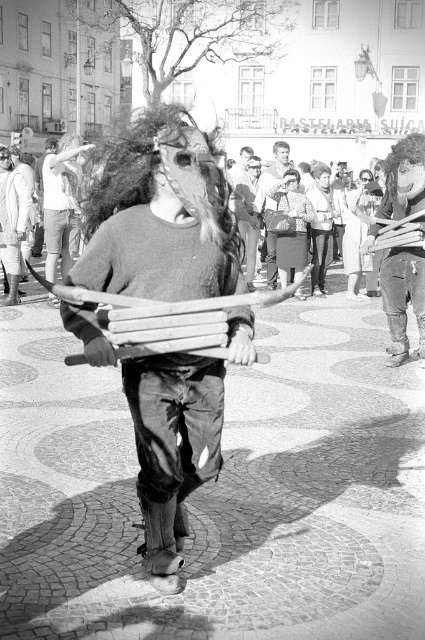
Is smooth leather jacket at center closer to camera compared to smooth brown leather bag at center?

Yes.

How far apart are smooth leather jacket at center and smooth brown leather bag at center?

smooth leather jacket at center and smooth brown leather bag at center are 14.18 inches apart.

Between point (255, 176) and point (286, 157), which one is positioned in front?

Positioned in front is point (255, 176).

The width and height of the screenshot is (425, 640). I want to click on smooth leather jacket at center, so click(248, 212).

Does fluffy dark brown hair at center have a greater height compared to smooth brown leather bag at center?

No, fluffy dark brown hair at center is not taller than smooth brown leather bag at center.

Does fluffy dark brown hair at center have a lesser height compared to smooth brown leather bag at center?

Correct, fluffy dark brown hair at center is not as tall as smooth brown leather bag at center.

Is point (172, 113) farther from camera compared to point (268, 276)?

No.

Identify the location of fluffy dark brown hair at center. This screenshot has width=425, height=640. (164, 173).

Between wooden stick at center and smooth brown leather bag at center, which one appears on the right side from the viewer's perspective?

Positioned to the right is smooth brown leather bag at center.

Does wooden stick at center have a smaller size compared to smooth brown leather bag at center?

Correct, wooden stick at center occupies less space than smooth brown leather bag at center.

In order to click on wooden stick at center in this screenshot , I will do `click(156, 221)`.

Locate an element on the screen. The image size is (425, 640). wooden stick at center is located at coordinates (156, 221).